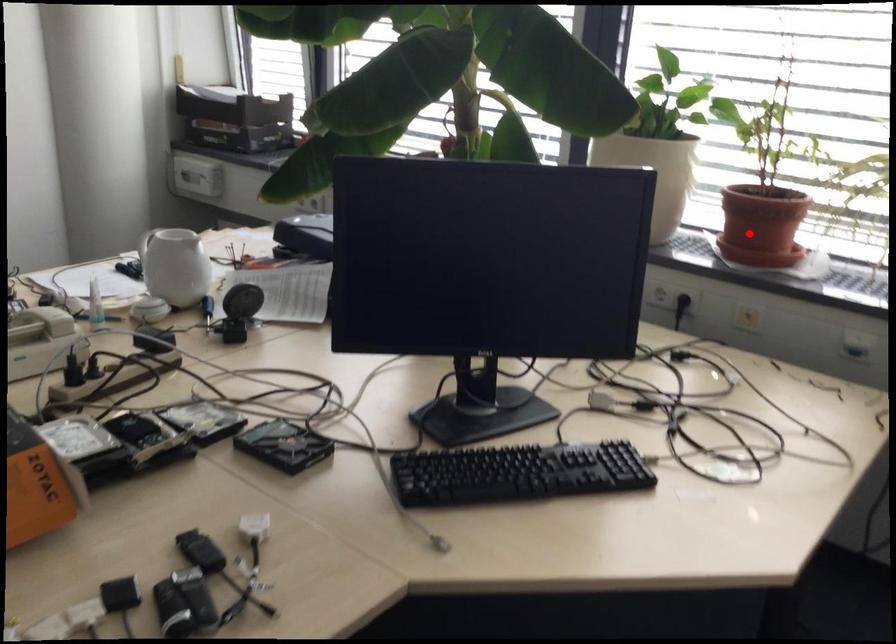
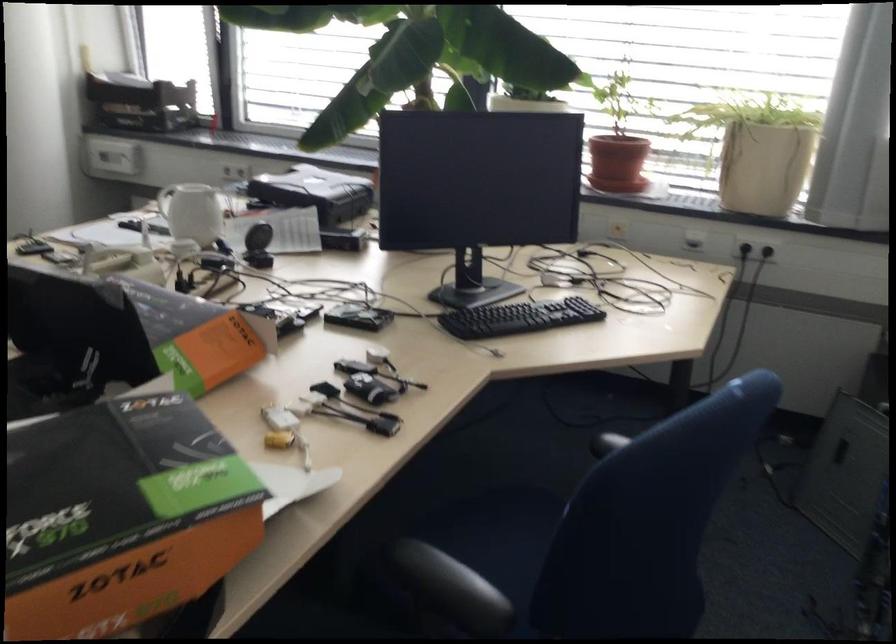
Question: I am providing you with two images of the same scene from different viewpoints. In image1, a red point is highlighted. Considering the same 3D point in image2, which of the following is correct?

Choices:
 (A) It is closer
 (B) It is farther

Answer: (B)